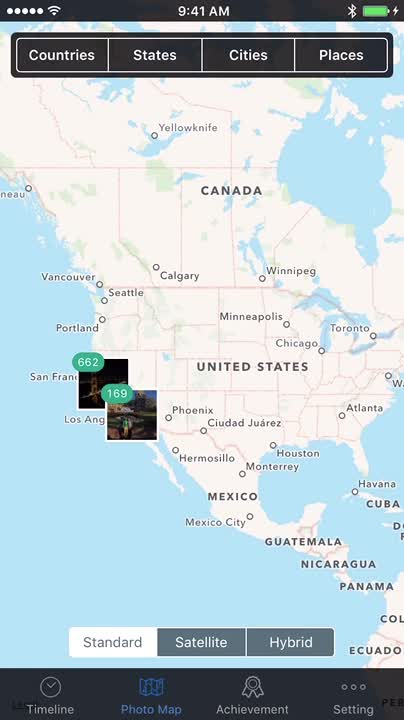
Find the location of a particular element. The width and height of the screenshot is (404, 720). grey clock is located at coordinates point(50,695).